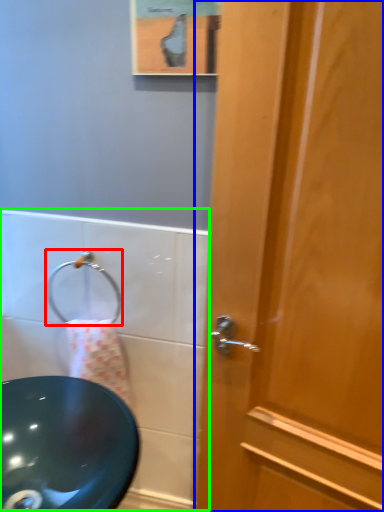
Question: Estimate the real-world distances between objects in this image. Which object is farther from shower (highlighted by a red box), door (highlighted by a blue box) or bath (highlighted by a green box)?

Choices:
 (A) door
 (B) bath

Answer: (A)